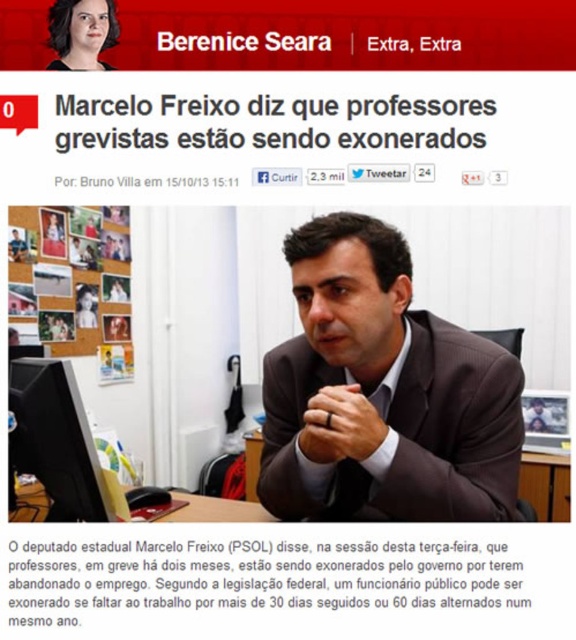
You are a photographer standing in front of the black glossy monitor at lower left and the matte black hair at upper left. You need to take a photo that captures both objects in the frame. Given that your camera has a maximum focus range of 90 centimeters, will you be able to capture both objects in focus?

The black glossy monitor at lower left and matte black hair at upper left are 93.56 centimeters apart from each other. Since the distance between them exceeds the camera maximum focus range of 90 centimeters, you won t be able to capture both objects in focus.

You are a journalist analyzing the image of the news article. You see the brown suit at center and the matte black hair at upper left. Based on their positions, which object is located to the right of the other?

The brown suit at center is to the right of the matte black hair at upper left.